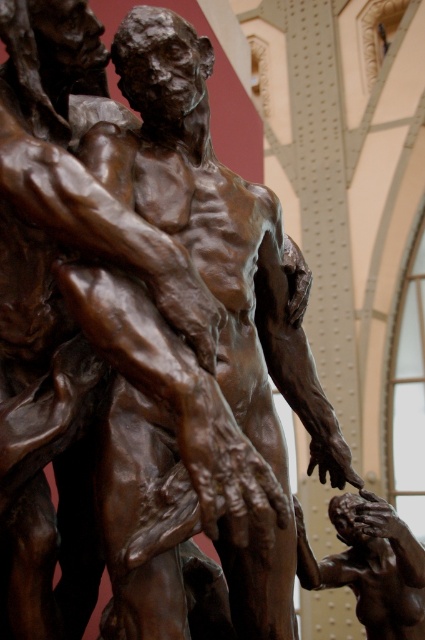
Measure the distance between point (150, 490) and camera.

Point (150, 490) is 25.91 feet away from camera.

How far apart are bronze statue at center and bronze figure at center?

bronze statue at center and bronze figure at center are 6.78 meters apart.

Which is in front, point (180, 65) or point (303, 545)?

Point (180, 65)

You are a GUI agent. You are given a task and a screenshot of the screen. Output one action in this format:
    pyautogui.click(x=<x>, y=<y>)
    Task: Click on the bronze statue at center
    This screenshot has height=640, width=425.
    Given the screenshot: What is the action you would take?
    pyautogui.click(x=215, y=236)